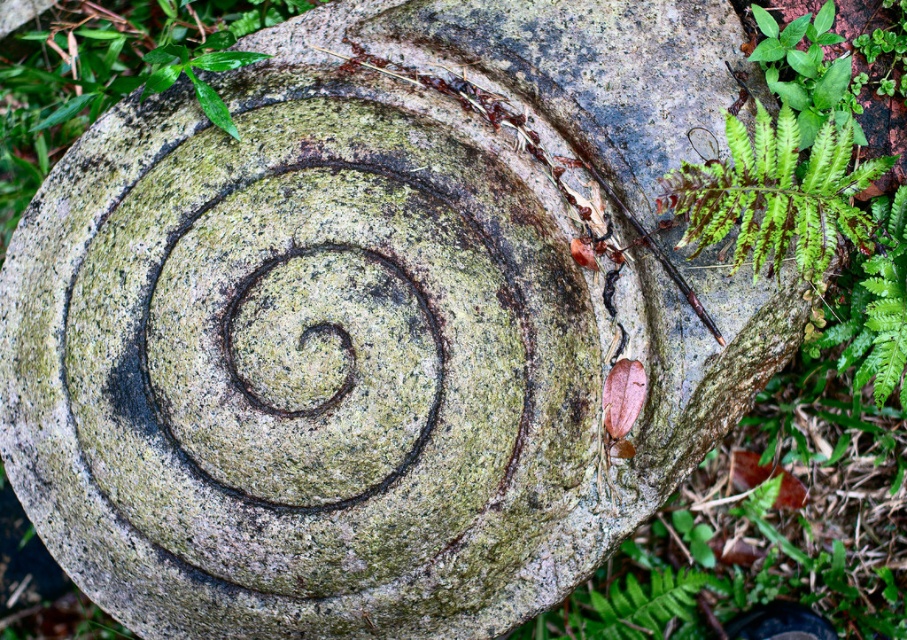
You are standing 2 meters away from the camera position. Can you see the point at coordinates point (23, 128)?

The point at coordinates point (23, 128) is 1.90 meters from the camera. Since you are standing 2 meters away from the camera position, you are slightly further away than the point, so you can see the point at coordinates point (23, 128).